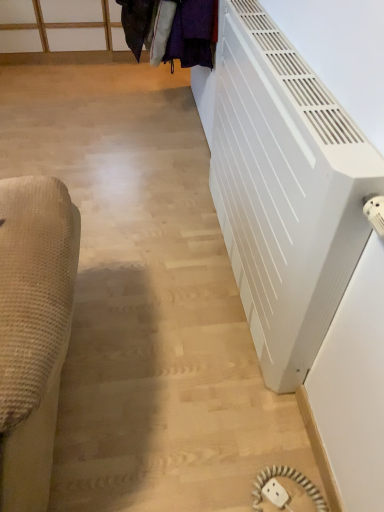
Where is `free spot in front of white matte radiator at right`? The width and height of the screenshot is (384, 512). free spot in front of white matte radiator at right is located at coordinates (196, 390).